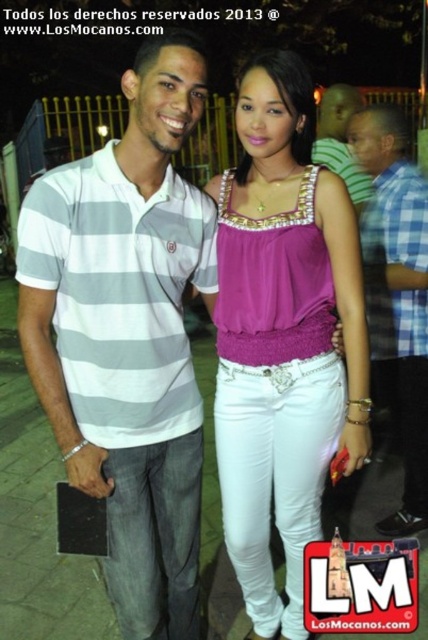
Question: Estimate the real-world distances between objects in this image. Which object is closer to the purple beaded tank top at center?

Choices:
 (A) matte gray striped polo shirt at center
 (B) gray striped polo shirt at left
 (C) gray striped shirt at center

Answer: (B)

Question: Which point is farther to the camera?

Choices:
 (A) matte gray striped polo shirt at center
 (B) purple beaded tank top at center
 (C) gray striped shirt at center

Answer: (A)

Question: Does gray striped polo shirt at left have a larger size compared to gray striped shirt at center?

Choices:
 (A) yes
 (B) no

Answer: (B)

Question: Does gray striped shirt at center come in front of matte gray striped polo shirt at center?

Choices:
 (A) yes
 (B) no

Answer: (A)

Question: Which point is closer to the camera?

Choices:
 (A) (318, 392)
 (B) (377, 243)
 (C) (207, 292)

Answer: (A)

Question: Is gray striped polo shirt at left thinner than purple beaded tank top at center?

Choices:
 (A) no
 (B) yes

Answer: (A)